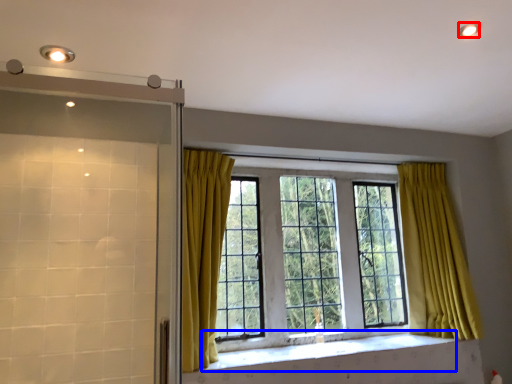
Question: Which point is further to the camera, lighting (highlighted by a red box) or window sill (highlighted by a blue box)?

Choices:
 (A) lighting
 (B) window sill

Answer: (B)